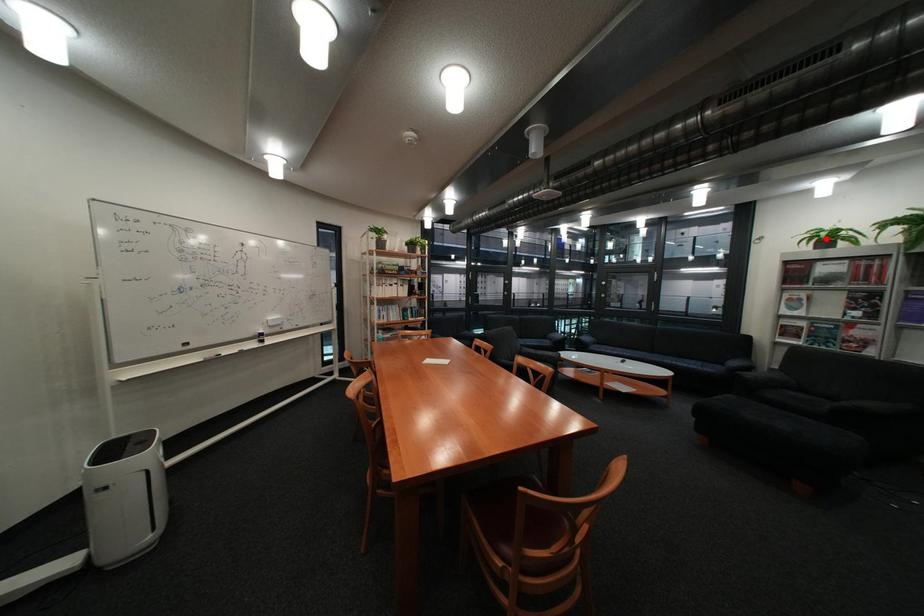
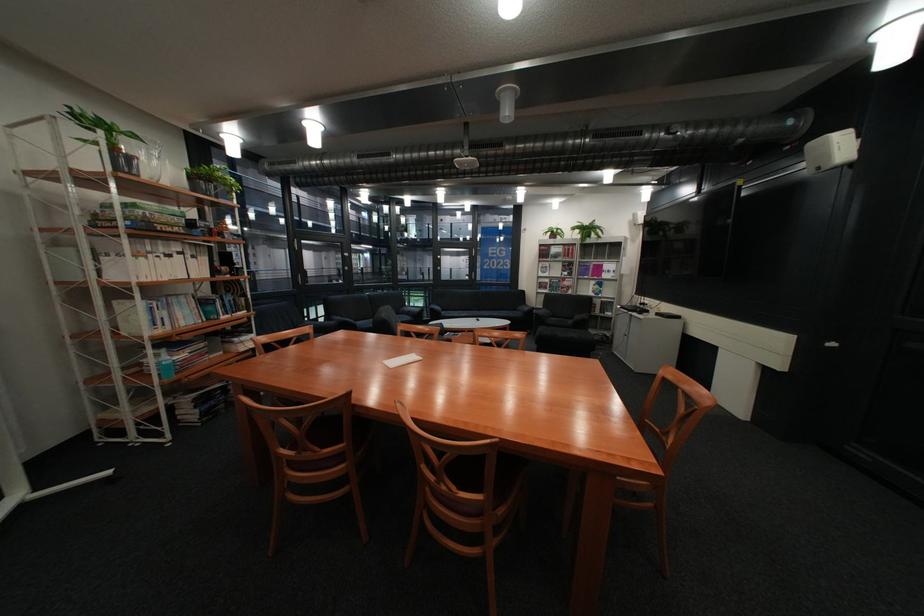
In the second image, find the point that corresponds to the highlighted location in the first image.

(562, 233)